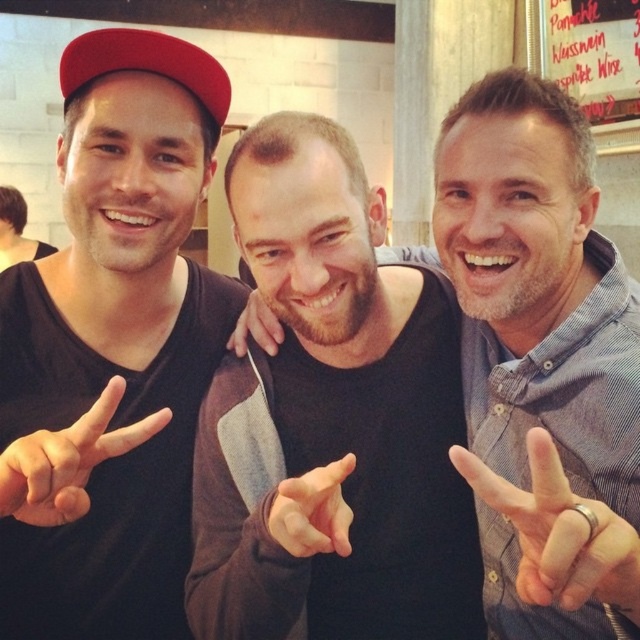
What do you see at coordinates (540, 360) in the screenshot? I see `black matte shirt at center` at bounding box center [540, 360].

Identify the location of black matte shirt at center. This screenshot has width=640, height=640. (540, 360).

You are a GUI agent. You are given a task and a screenshot of the screen. Output one action in this format:
    pyautogui.click(x=<x>, y=<y>)
    Task: Click on the black matte shirt at center
    The image size is (640, 640).
    Given the screenshot: What is the action you would take?
    pyautogui.click(x=540, y=360)

The image size is (640, 640). What do you see at coordinates (560, 532) in the screenshot?
I see `silver metallic ring at right` at bounding box center [560, 532].

Between silver metallic ring at right and matte red baseball cap at upper left, which one has less height?

Standing shorter between the two is matte red baseball cap at upper left.

Which is in front, point (621, 563) or point (68, 52)?

Point (621, 563) is more forward.

This screenshot has width=640, height=640. Identify the location of silver metallic ring at right. (560, 532).

Between matte red baseball cap at upper left and brown leather hand at center, which one appears on the left side from the viewer's perspective?

From the viewer's perspective, matte red baseball cap at upper left appears more on the left side.

Which of these two, matte red baseball cap at upper left or brown leather hand at center, stands shorter?

matte red baseball cap at upper left

Is point (120, 58) farther from camera compared to point (278, 321)?

No, it is not.

I want to click on matte red baseball cap at upper left, so click(145, 65).